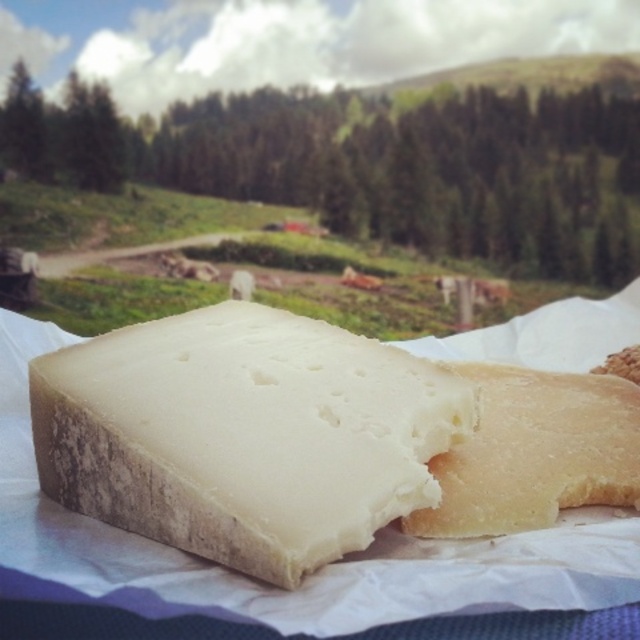
Question: Does white crumbly cheese at center have a smaller size compared to white crumbly bread at center?

Choices:
 (A) yes
 (B) no

Answer: (B)

Question: Which of the following is the farthest from the observer?

Choices:
 (A) (445, 499)
 (B) (248, 556)

Answer: (A)

Question: Is white crumbly cheese at center bigger than white crumbly bread at center?

Choices:
 (A) yes
 (B) no

Answer: (A)

Question: Which point is closer to the camera taking this photo?

Choices:
 (A) (460, 490)
 (B) (102, 516)

Answer: (B)

Question: Does white crumbly cheese at center have a lesser width compared to white crumbly bread at center?

Choices:
 (A) yes
 (B) no

Answer: (B)